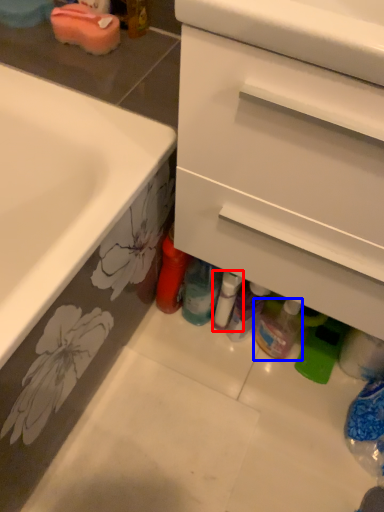
Question: Among these objects, which one is nearest to the camera, bottle (highlighted by a red box) or bottle (highlighted by a blue box)?

Choices:
 (A) bottle
 (B) bottle

Answer: (B)